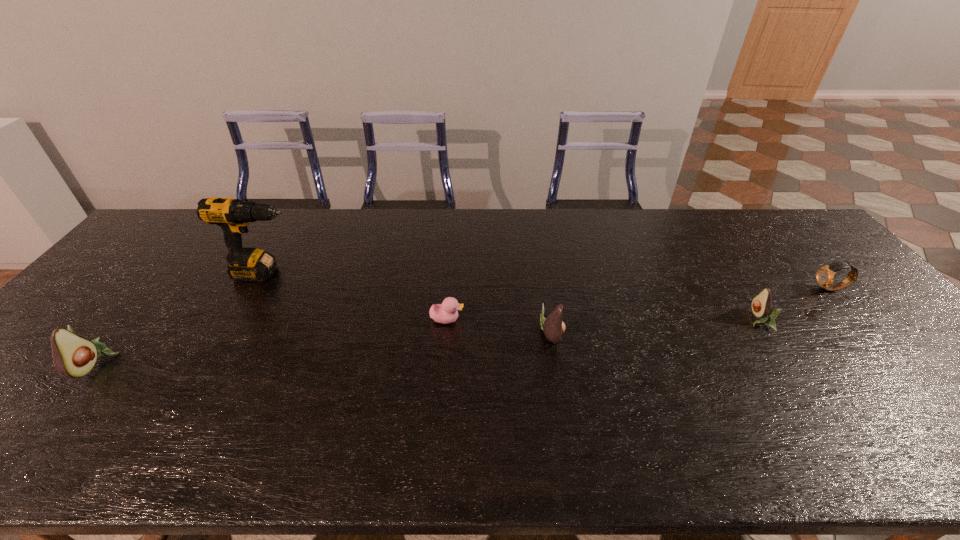
To make them evenly spaced by inserting another avocado among them, please locate a free space for this new avocado. Please provide its 2D coordinates. Your answer should be formatted as a tuple, i.e. [(x, y)], where the tuple contains the x and y coordinates of a point satisfying the conditions above.

[(331, 348)]